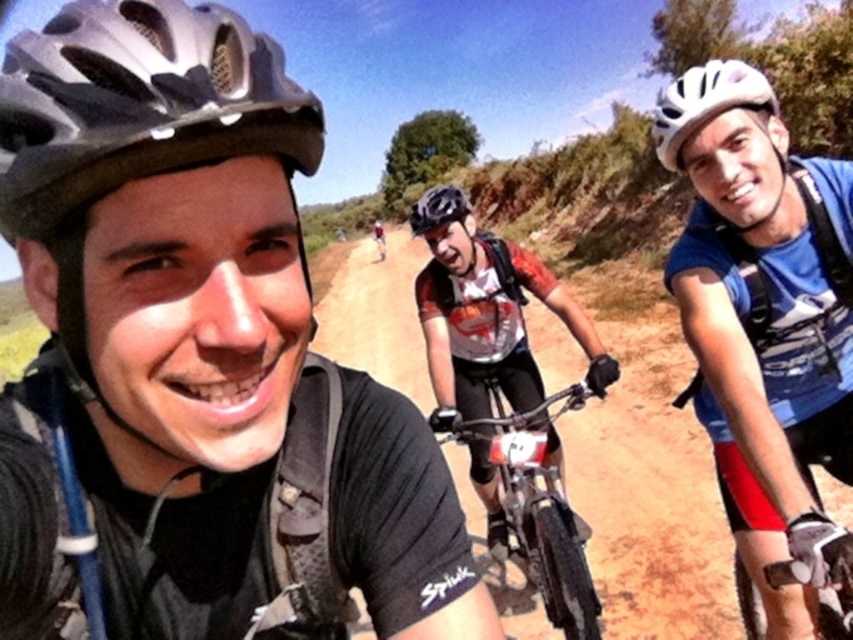
You are a photographer trying to capture a clear photo of the metallic silver helmet at upper left and the shiny metallic bike at center. Since you want both subjects to be in focus, which one should you focus on first to ensure the other is also in focus?

You should focus on the metallic silver helmet at upper left first because it is closer to you than the shiny metallic bike at center. By focusing on the closer object, the background object will also be in focus due to depth of field.

What is the object located at the coordinates point (537, 502)?

The object located at point (537, 502) is a shiny metallic bike at center.